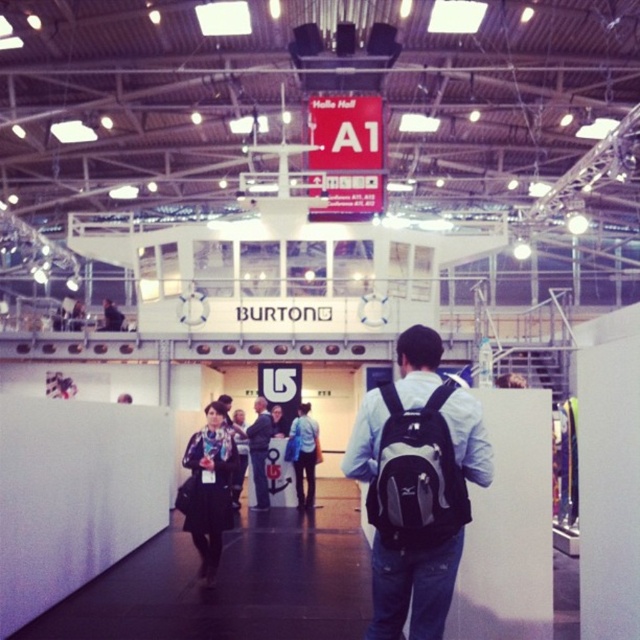
Question: Which object is positioned closest to the blue fabric jacket at center?

Choices:
 (A) dark blue jeans at center
 (B) patterned scarf at center

Answer: (A)

Question: Can you confirm if blue fabric jacket at center is positioned above dark blue jeans at center?

Choices:
 (A) no
 (B) yes

Answer: (A)

Question: Is patterned scarf at center bigger than blue fabric jacket at center?

Choices:
 (A) no
 (B) yes

Answer: (A)

Question: Can you confirm if black backpack at center is positioned above blue fabric jacket at center?

Choices:
 (A) no
 (B) yes

Answer: (B)

Question: Among these objects, which one is farthest from the camera?

Choices:
 (A) gray fabric backpack at center
 (B) black backpack at center
 (C) patterned scarf at center
 (D) dark blue jeans at center

Answer: (D)

Question: Which point is farther to the camera?

Choices:
 (A) (312, 483)
 (B) (349, 472)
 (C) (449, 484)
 (D) (248, 433)

Answer: (A)